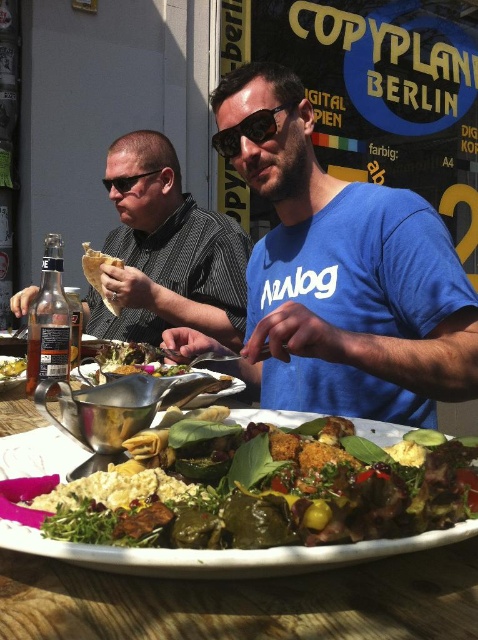
Between blue cotton shirt at center and yellowish matte hummus at center, which one has less height?

Standing shorter between the two is yellowish matte hummus at center.

Does blue cotton shirt at center have a greater width compared to yellowish matte hummus at center?

Indeed, blue cotton shirt at center has a greater width compared to yellowish matte hummus at center.

Which is in front, point (312, 392) or point (15, 365)?

Positioned in front is point (15, 365).

Where is `blue cotton shirt at center`? The height and width of the screenshot is (640, 478). blue cotton shirt at center is located at coordinates (345, 278).

In the scene shown: Does matte black shirt at left have a lesser height compared to black plastic sunglasses at center?

In fact, matte black shirt at left may be taller than black plastic sunglasses at center.

Can you confirm if matte black shirt at left is bigger than black plastic sunglasses at center?

Indeed, matte black shirt at left has a larger size compared to black plastic sunglasses at center.

What do you see at coordinates (167, 253) in the screenshot? Image resolution: width=478 pixels, height=640 pixels. I see `matte black shirt at left` at bounding box center [167, 253].

At what (x,y) coordinates should I click in order to perform the action: click on matte black shirt at left. Please return your answer as a coordinate pair (x, y). The image size is (478, 640). Looking at the image, I should click on (167, 253).

What do you see at coordinates (345, 278) in the screenshot? The width and height of the screenshot is (478, 640). I see `blue cotton shirt at center` at bounding box center [345, 278].

Does blue cotton shirt at center have a lesser width compared to black plastic sunglasses at center?

Incorrect, blue cotton shirt at center's width is not less than black plastic sunglasses at center's.

This screenshot has width=478, height=640. What are the coordinates of `blue cotton shirt at center` in the screenshot? It's located at (345, 278).

Locate an element on the screen. This screenshot has width=478, height=640. blue cotton shirt at center is located at coordinates (345, 278).